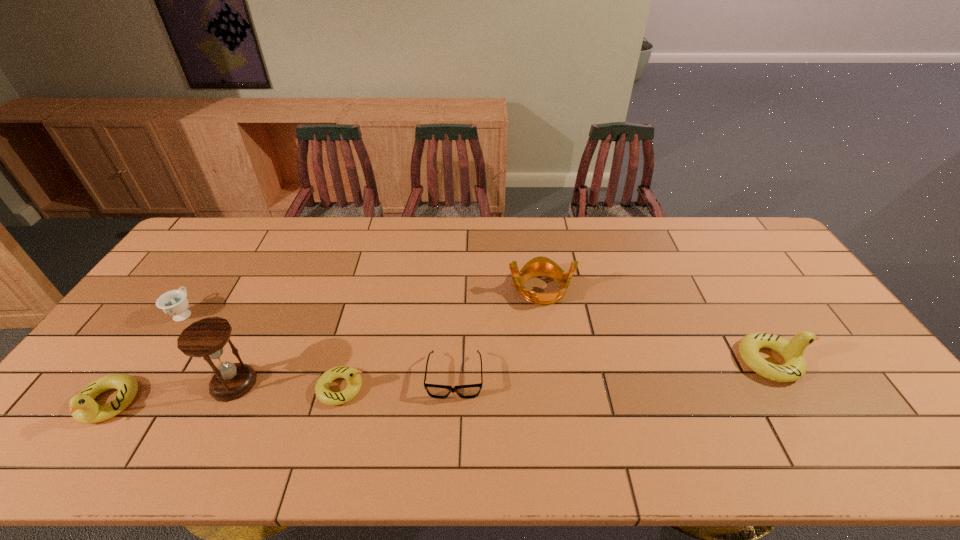
Identify the location of the third object from right to left. (473, 390).

The width and height of the screenshot is (960, 540). In order to click on vacant point located 0.210m on the face of the fourth object from left to right in this screenshot , I will do `click(449, 388)`.

You are a GUI agent. You are given a task and a screenshot of the screen. Output one action in this format:
    pyautogui.click(x=<x>, y=<y>)
    Task: Click on the vacant space situated 0.140m on the face of the rightmost object
    Image resolution: width=960 pixels, height=540 pixels.
    Given the screenshot: What is the action you would take?
    pyautogui.click(x=856, y=361)

The width and height of the screenshot is (960, 540). Identify the location of free point located 0.140m at the front emblem of the tiara. (463, 289).

You are a GUI agent. You are given a task and a screenshot of the screen. Output one action in this format:
    pyautogui.click(x=<x>, y=<y>)
    Task: Click on the free spot located at the front emblem of the tiara
    
    Given the screenshot: What is the action you would take?
    pyautogui.click(x=453, y=289)

Find the location of a particular element. The image size is (960, 540). vacant region located 0.210m at the front emblem of the tiara is located at coordinates (441, 289).

Locate an element on the screen. Image resolution: width=960 pixels, height=540 pixels. free space located 0.240m on the side of the teacup with the handle is located at coordinates (226, 252).

The height and width of the screenshot is (540, 960). Identify the location of free space located on the side of the teacup with the handle. (214, 268).

This screenshot has width=960, height=540. I want to click on free spot located on the side of the teacup with the handle, so click(202, 287).

Where is `vacant space situated on the back of the fifth object from right to left`? vacant space situated on the back of the fifth object from right to left is located at coordinates (252, 347).